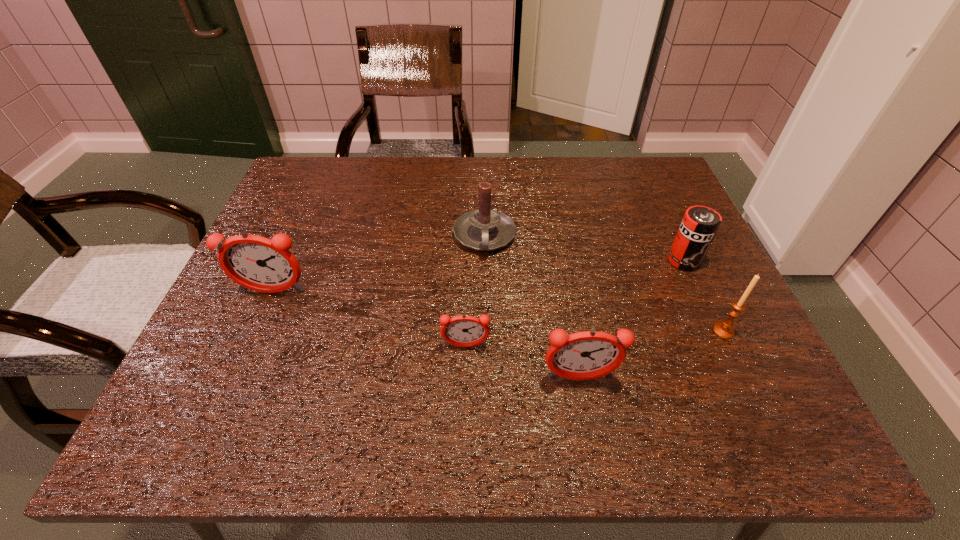
The height and width of the screenshot is (540, 960). Identify the location of the third farthest object. (x=255, y=262).

At what (x,y) coordinates should I click in order to perform the action: click on the leftmost alarm clock. Please return your answer as a coordinate pair (x, y). Looking at the image, I should click on (255, 262).

Find the location of a particular element. This screenshot has width=960, height=540. the fifth farthest object is located at coordinates (463, 331).

Where is `the shortest alarm clock`? the shortest alarm clock is located at coordinates (463, 331).

Identify the location of the fourth object from left to right. (585, 355).

Find the location of a particular element. The height and width of the screenshot is (540, 960). the second tallest alarm clock is located at coordinates (585, 355).

Locate an element on the screen. the fourth farthest object is located at coordinates click(724, 329).

Image resolution: width=960 pixels, height=540 pixels. I want to click on can, so click(700, 224).

Where is `candle`? The height and width of the screenshot is (540, 960). candle is located at coordinates (484, 229).

This screenshot has height=540, width=960. Identify the location of free space located 0.170m on the front-facing side of the leftmost object. (241, 364).